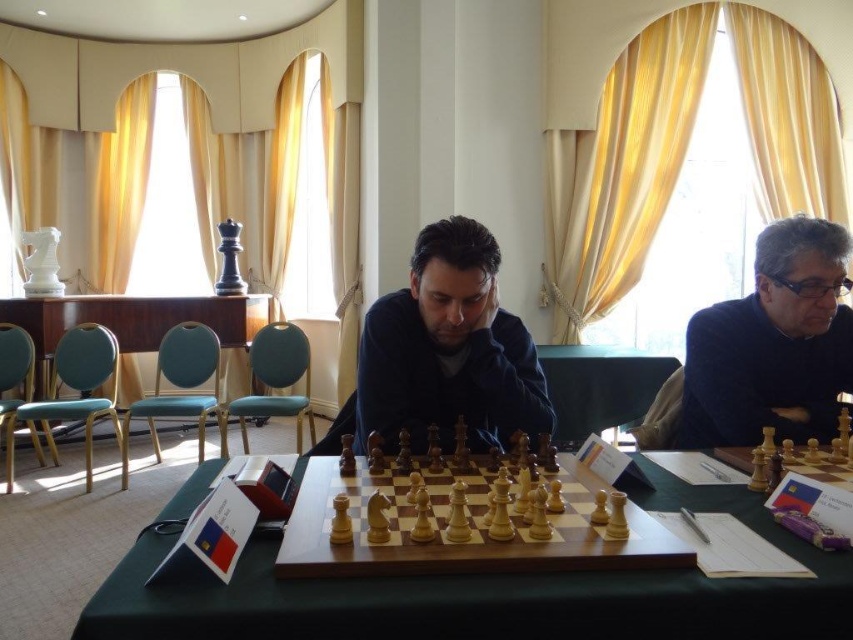
In the scene shown: You are a photographer who needs to adjust your camera to capture a closeup of the dark blue sweater at center. The camera has a minimum focusing distance of 1.5 meters. Can you take the photo without moving the camera or the sweater?

The dark blue sweater at center and camera are 1.46 meters apart from each other. Since the minimum focusing distance is 1.5 meters, the camera cannot focus properly at 1.46 meters. You need to move either the camera or the sweater to increase the distance to at least 1.5 meters.

Based on the photo, you are a photographer positioned at the front of the room. You want to capture a photo that includes both the point at coordinates point (415, 348) and point (439, 486). To ensure both points are in focus, which point should you focus on first to maintain depth of field?

You should focus on point (415, 348) first because it is closer to you than point (439, 486), and focusing on the closer object will help keep both in focus due to depth of field principles.